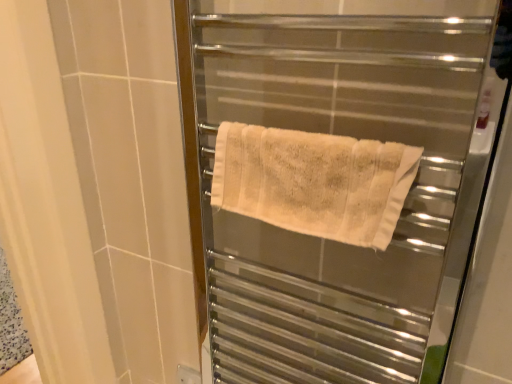
Question: Does white textured towel at center have a lesser width compared to beige cotton towel at center?

Choices:
 (A) yes
 (B) no

Answer: (B)

Question: From a real-world perspective, is white textured towel at center below beige cotton towel at center?

Choices:
 (A) yes
 (B) no

Answer: (A)

Question: Is white textured towel at center positioned with its back to beige cotton towel at center?

Choices:
 (A) no
 (B) yes

Answer: (B)

Question: Is white textured towel at center outside of beige cotton towel at center?

Choices:
 (A) no
 (B) yes

Answer: (B)

Question: Does white textured towel at center have a greater height compared to beige cotton towel at center?

Choices:
 (A) no
 (B) yes

Answer: (B)

Question: Is white textured towel at center touching beige cotton towel at center?

Choices:
 (A) no
 (B) yes

Answer: (B)

Question: Does beige cotton towel at center lie in front of white textured towel at center?

Choices:
 (A) no
 (B) yes

Answer: (A)

Question: From a real-world perspective, is beige cotton towel at center located beneath white textured towel at center?

Choices:
 (A) no
 (B) yes

Answer: (A)

Question: Considering the relative positions of beige cotton towel at center and white textured towel at center in the image provided, is beige cotton towel at center to the right of white textured towel at center from the viewer's perspective?

Choices:
 (A) yes
 (B) no

Answer: (B)

Question: Could white textured towel at center be considered to be inside beige cotton towel at center?

Choices:
 (A) yes
 (B) no

Answer: (B)

Question: Is beige cotton towel at center looking in the opposite direction of white textured towel at center?

Choices:
 (A) no
 (B) yes

Answer: (B)

Question: Does beige cotton towel at center have a larger size compared to white textured towel at center?

Choices:
 (A) no
 (B) yes

Answer: (A)

Question: Is beige cotton towel at center situated inside white textured towel at center or outside?

Choices:
 (A) outside
 (B) inside

Answer: (B)